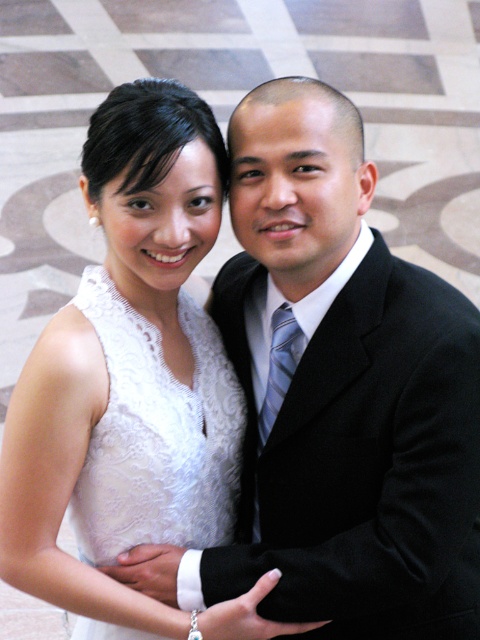
Is black satin business suit at right in front of white lace dress at center?

Yes, black satin business suit at right is closer to the viewer.

Is point (352, 278) positioned behind point (197, 451)?

No, (352, 278) is in front of (197, 451).

This screenshot has width=480, height=640. I want to click on black satin business suit at right, so tap(360, 458).